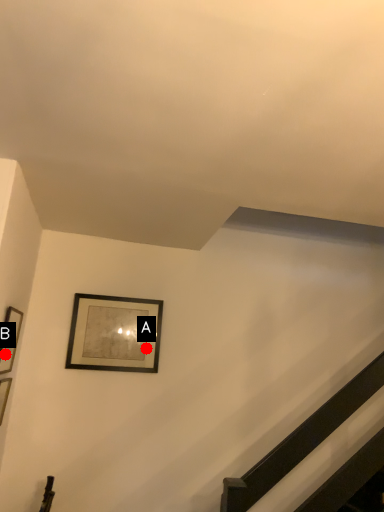
Question: Two points are circled on the image, labeled by A and B beside each circle. Which point is further to the camera?

Choices:
 (A) A is further
 (B) B is further

Answer: (A)